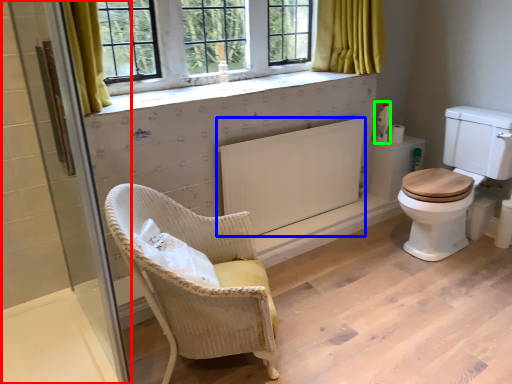
Question: Which is nearer to the screen door (highlighted by a red box)? radiator (highlighted by a blue box) or toiletries (highlighted by a green box).

Choices:
 (A) radiator
 (B) toiletries

Answer: (A)